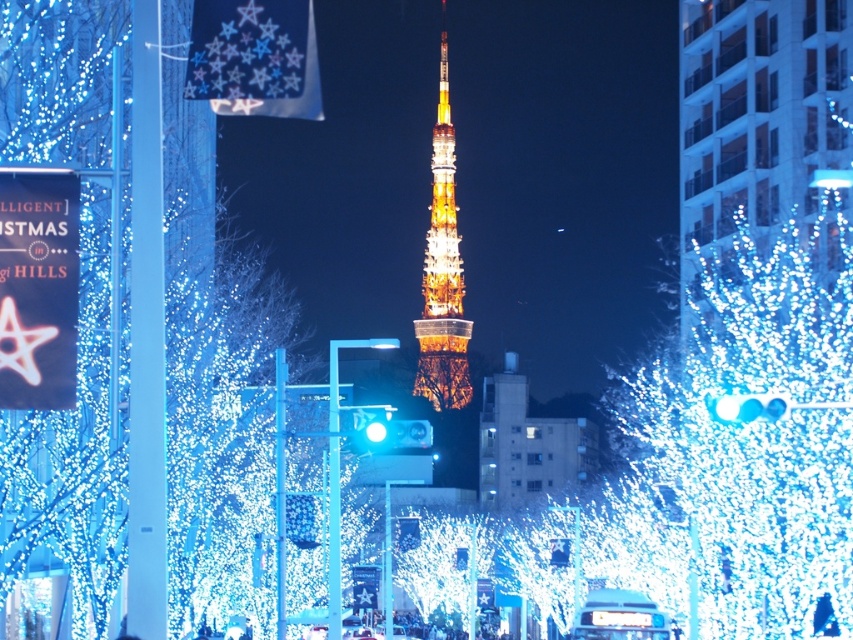
Does illuminated glass tower at center have a greater width compared to blue frosted bulb at center?

Correct, the width of illuminated glass tower at center exceeds that of blue frosted bulb at center.

At what (x,y) coordinates should I click in order to perform the action: click on illuminated glass tower at center. Please return your answer as a coordinate pair (x, y). Looking at the image, I should click on (759, 125).

Identify the location of illuminated glass tower at center. The width and height of the screenshot is (853, 640). (759, 125).

Locate an element on the screen. This screenshot has height=640, width=853. illuminated metal tower at center is located at coordinates (442, 272).

Can you confirm if illuminated metal tower at center is wider than blue frosted bulb at center?

Correct, the width of illuminated metal tower at center exceeds that of blue frosted bulb at center.

Between point (437, 288) and point (770, 401), which one is positioned behind?

Positioned behind is point (437, 288).

You are a GUI agent. You are given a task and a screenshot of the screen. Output one action in this format:
    pyautogui.click(x=<x>, y=<y>)
    Task: Click on the illuminated metal tower at center
    
    Given the screenshot: What is the action you would take?
    pyautogui.click(x=442, y=272)

Does illuminated glass tower at center have a smaller size compared to illuminated metal tower at center?

Incorrect, illuminated glass tower at center is not smaller in size than illuminated metal tower at center.

Who is lower down, illuminated glass tower at center or illuminated metal tower at center?

Positioned lower is illuminated metal tower at center.

Measure the distance between point (831, 56) and camera.

Point (831, 56) is 846.15 feet away from camera.

Locate an element on the screen. illuminated glass tower at center is located at coordinates click(x=759, y=125).